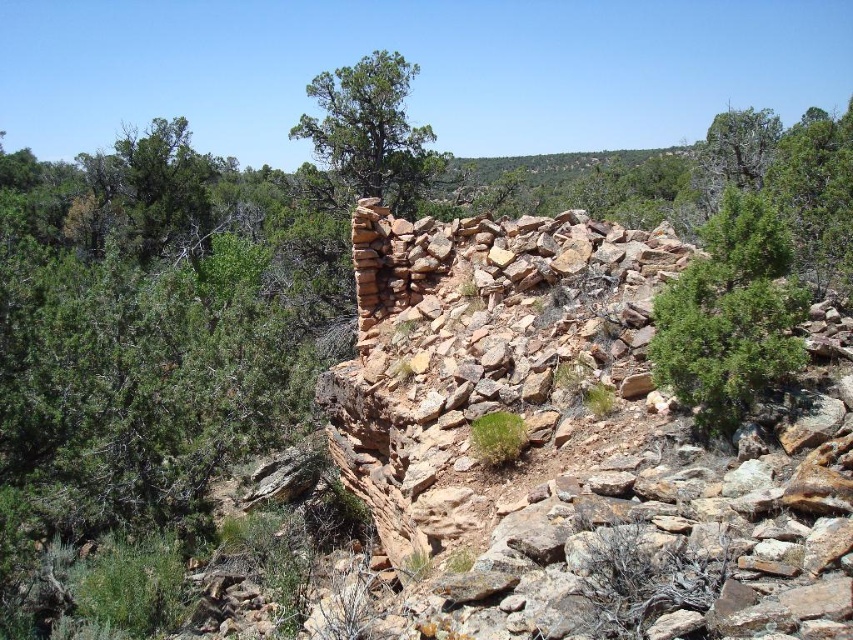
Is green rough textured tree at upper right above green textured tree at upper center?

No, green rough textured tree at upper right is not above green textured tree at upper center.

Does green rough textured tree at upper right have a greater height compared to green textured tree at upper center?

In fact, green rough textured tree at upper right may be shorter than green textured tree at upper center.

Image resolution: width=853 pixels, height=640 pixels. I want to click on green rough textured tree at upper right, so click(730, 316).

The image size is (853, 640). What do you see at coordinates (730, 316) in the screenshot?
I see `green rough textured tree at upper right` at bounding box center [730, 316].

Find the location of a particular element. Image resolution: width=853 pixels, height=640 pixels. green rough textured tree at upper right is located at coordinates (730, 316).

The width and height of the screenshot is (853, 640). What are the coordinates of `green rough textured tree at upper right` in the screenshot? It's located at (730, 316).

Between point (418, 198) and point (804, 221), which one is positioned in front?

Positioned in front is point (804, 221).

Where is `green textured tree at upper center`? green textured tree at upper center is located at coordinates (367, 138).

This screenshot has width=853, height=640. I want to click on green textured tree at upper center, so click(x=367, y=138).